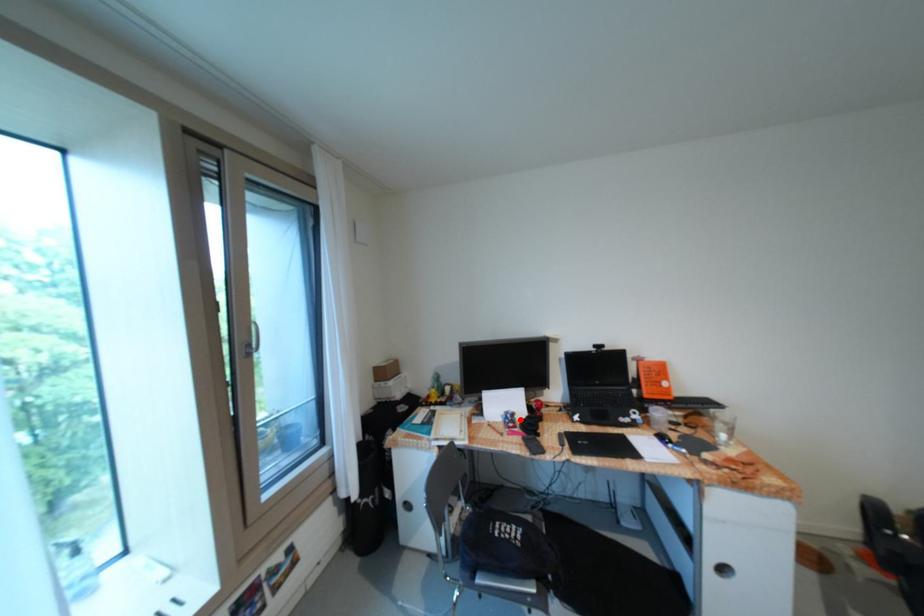
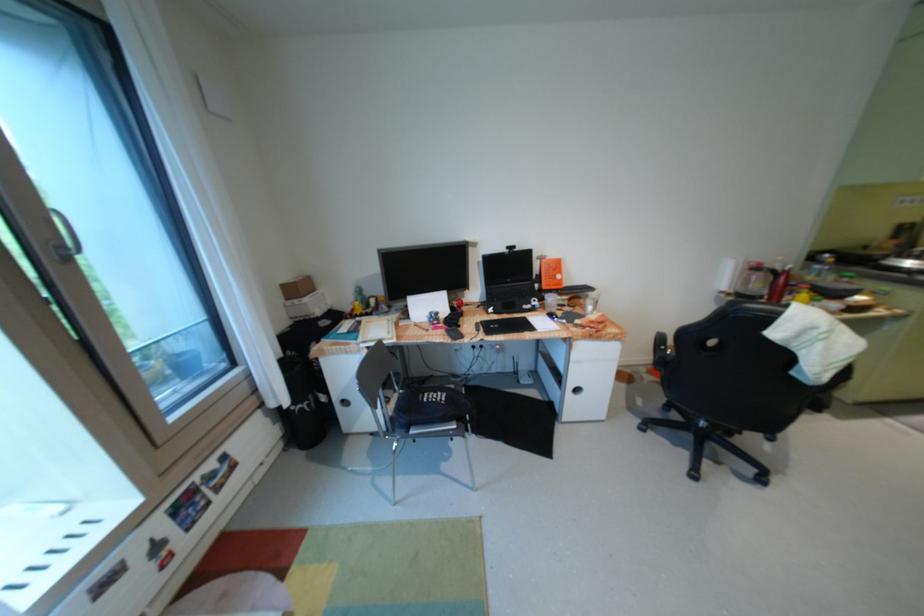
Where in the second image is the point corresponding to the highlighted location from the first image?

(444, 318)